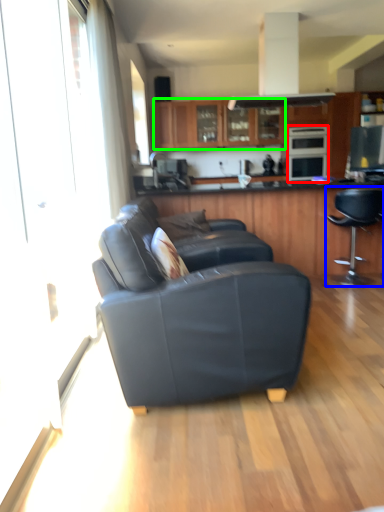
Question: Which object is the closest to the appliance (highlighted by a red box)? Choose among these: chair (highlighted by a blue box) or cabinetry (highlighted by a green box).

Choices:
 (A) chair
 (B) cabinetry

Answer: (B)